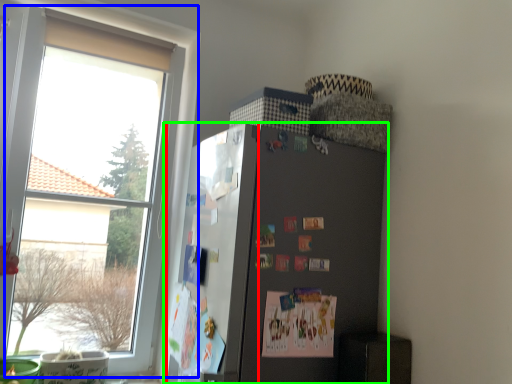
Question: Estimate the real-world distances between objects in this image. Which object is closer to bulletin board (highlighted by a red box), window (highlighted by a blue box) or refrigerator (highlighted by a green box)?

Choices:
 (A) window
 (B) refrigerator

Answer: (B)